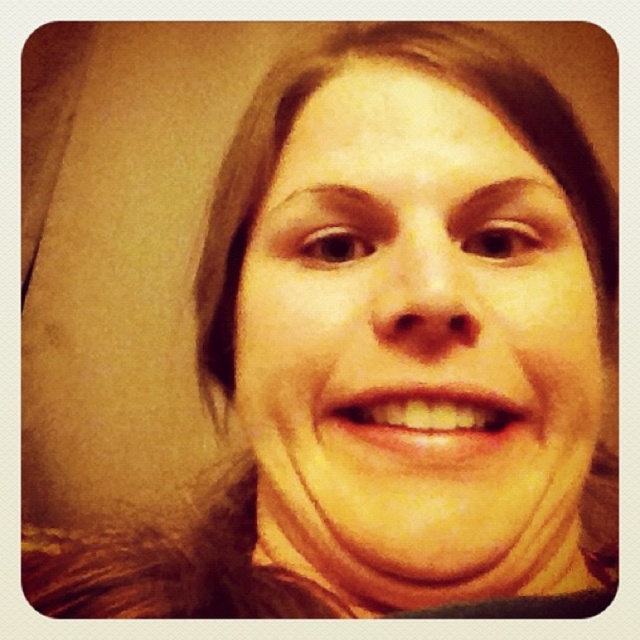
You are a photographer adjusting the focus of your camera. You want to ensure that both the smooth skin face at center and the yellow matte teeth at center are in focus. However, due to the camera settings, only one of them can be in sharp focus at a time. Which object should you choose to focus on to make sure the subject looks natural and well captured?

You should focus on the smooth skin face at center because it is closer to the viewer than the yellow matte teeth at center, ensuring the main subject area is sharp.

You are a photographer adjusting the framing of a portrait. The subject has a smooth skin face at center and yellow matte teeth at center. Based on the scene, which object is positioned higher in the image?

The smooth skin face at center is taller than yellow matte teeth at center, so the smooth skin face at center is positioned higher in the image.

From the picture: You are a photographer adjusting the lighting for a portrait. You notice the smooth skin face at center and the yellow matte teeth at center in the frame. Which object is positioned to the right of the other?

→ The smooth skin face at center is to the right of yellow matte teeth at center according to the description.